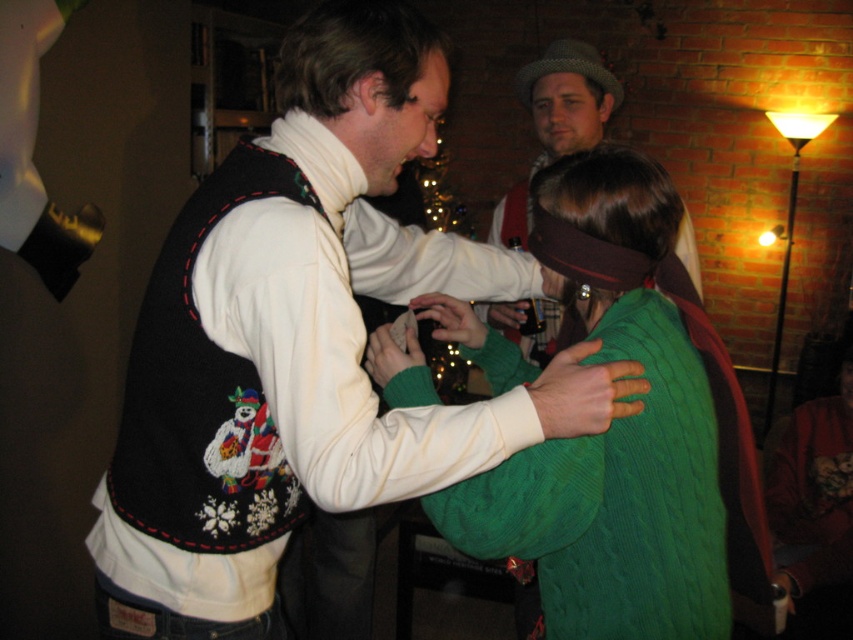
Which of these two, white sweater vest with snowman design at center or knitted wool hat at upper center, stands shorter?

Standing shorter between the two is knitted wool hat at upper center.

Locate an element on the screen. white sweater vest with snowman design at center is located at coordinates (302, 346).

Does green cable-knit sweater at center have a greater height compared to knitted wool hat at upper center?

No.

Is point (660, 625) closer to viewer compared to point (688, 227)?

Yes, point (660, 625) is in front of point (688, 227).

The width and height of the screenshot is (853, 640). I want to click on green cable-knit sweater at center, so click(619, 433).

Is point (479, 275) closer to viewer compared to point (540, 534)?

No, (479, 275) is further to viewer.

Which is behind, point (265, 442) or point (724, 529)?

Positioned behind is point (724, 529).

Locate an element on the screen. This screenshot has width=853, height=640. white sweater vest with snowman design at center is located at coordinates (302, 346).